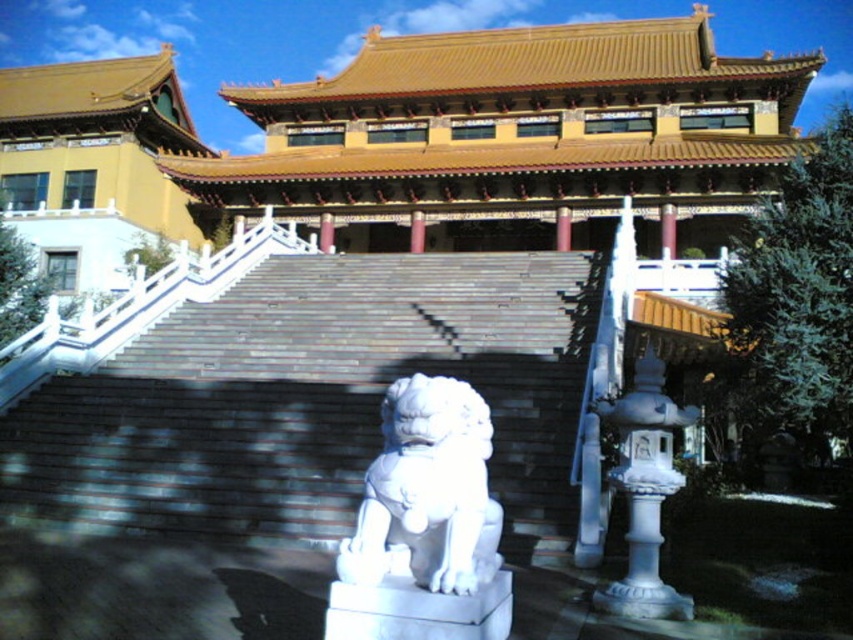
Looking at this image, you are a tourist visiting the temple and want to take a photo of the white stone stairs at center and the white stone lion at center. If you stand at the bottom of the stairs, which object will appear larger in your photo?

The white stone stairs at center will appear larger in your photo because they are wider than the white stone lion at center.

You are standing at the base of the wide staircase leading up to the entrance of the traditional Chinese building. You notice a specific point marked at coordinates (312, 397). Based on the scene description, can you identify what this point corresponds to?

The point at (312, 397) corresponds to the white stone stairs at center, as indicated by the object description.

You are standing at the bottom of the white stone stairs at center and want to reach the white stone lion at center. Which direction should you move towards?

The white stone stairs at center is positioned on the left side of the white stone lion at center, so you should move to your right to reach the white stone lion at center.